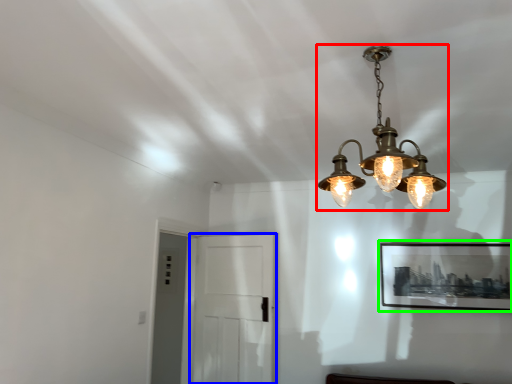
Question: Estimate the real-world distances between objects in this image. Which object is farther from lamp (highlighted by a red box), glass door (highlighted by a blue box) or picture frame (highlighted by a green box)?

Choices:
 (A) glass door
 (B) picture frame

Answer: (A)